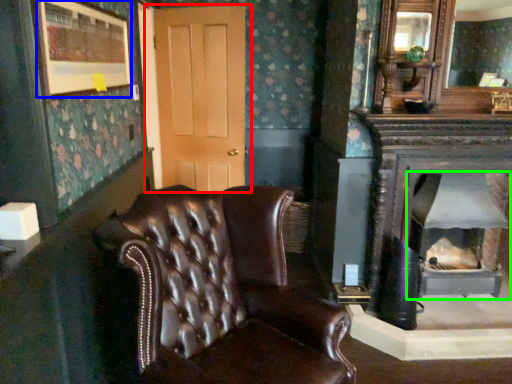
Question: Based on their relative distances, which object is nearer to door (highlighted by a red box)? Choose from picture frame (highlighted by a blue box) and wood burning stove (highlighted by a green box).

Choices:
 (A) picture frame
 (B) wood burning stove

Answer: (A)